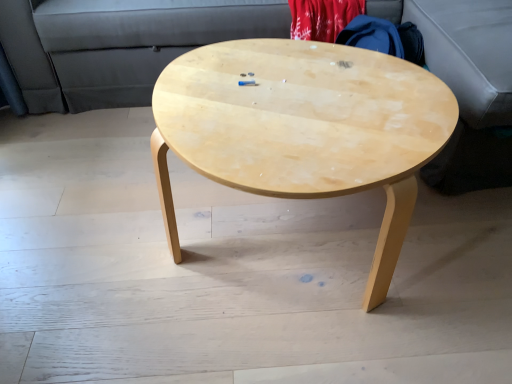
Locate an element on the screen. Image resolution: width=512 pixels, height=384 pixels. free space to the left of natural wood coffee table at center is located at coordinates (92, 244).